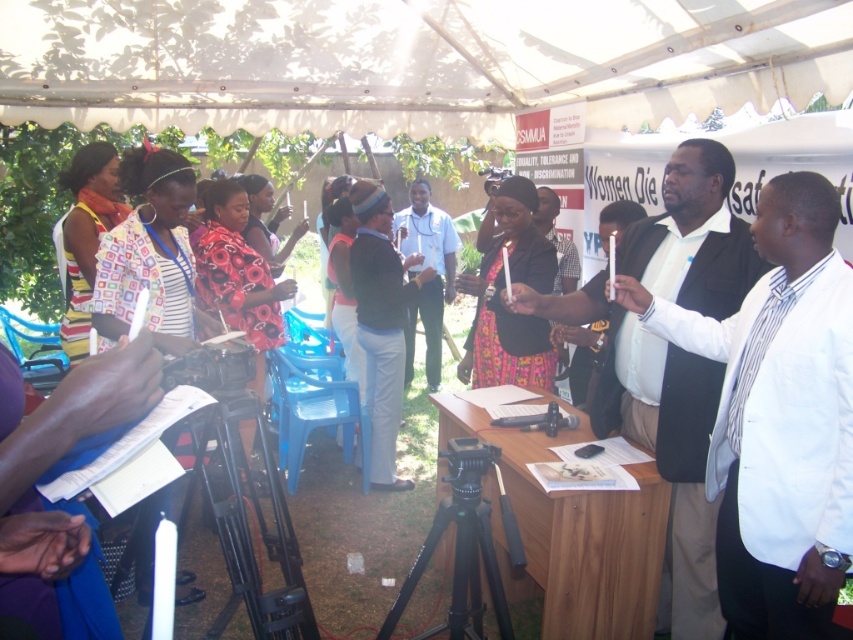
You are standing at the entrance of the event and need to locate the person wearing the white shirt at center. According to the coordinates provided, where should you look to find them?

The white shirt at center is located at coordinates point (654, 438), so you should look towards the lower right area of the image to find them.

You are a photographer at the event and need to capture a clear shot of both the white shirt at center and the knitted brown hat at center. Based on their positions, which object will appear larger in the photo?

The white shirt at center will appear larger in the photo because it is taller than the knitted brown hat at center.

You are organizing an outdoor event and need to place a knitted brown hat at center. Where exactly should you place it?

The knitted brown hat at center should be placed at point (381, 323).